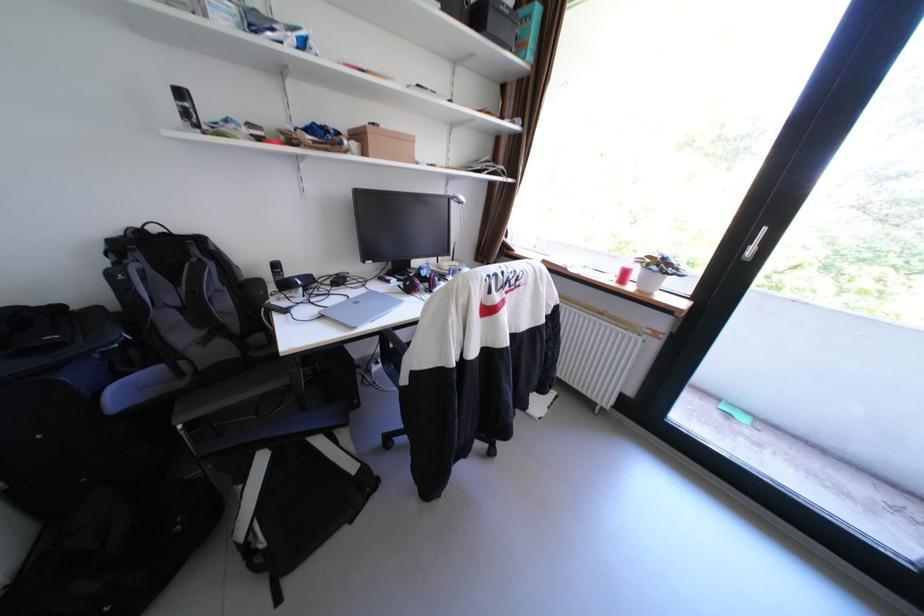
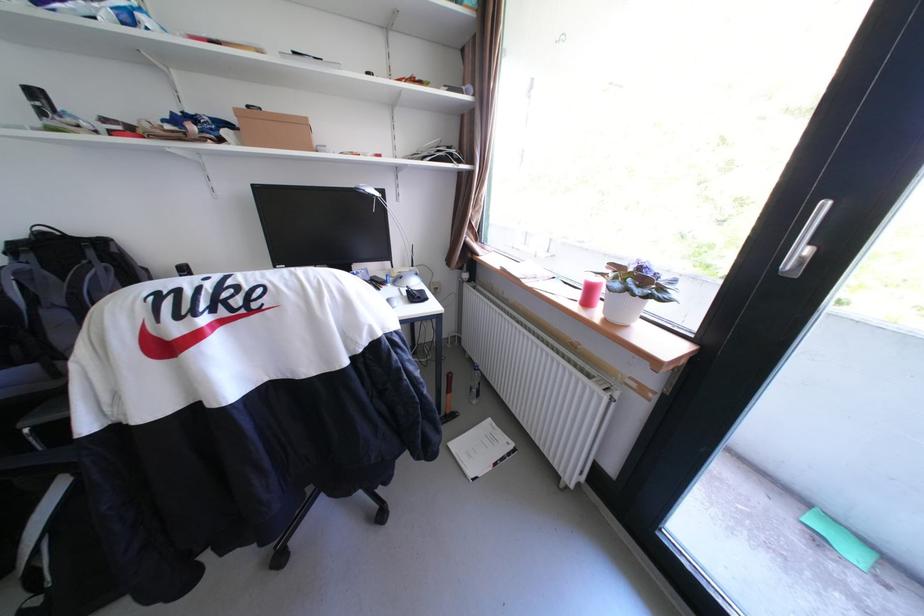
The point at [636,274] is marked in the first image. Where is the corresponding point in the second image?

(601, 291)